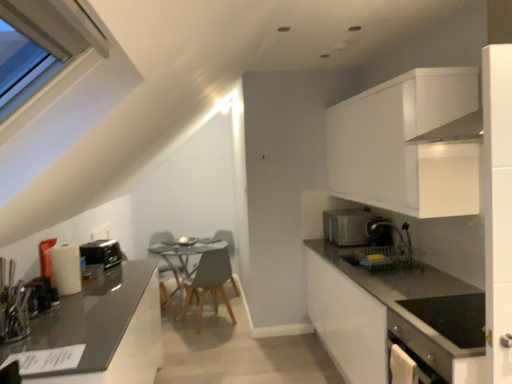
Question: In terms of size, does matte gray chair at center appear bigger or smaller than shiny dark gray countertop at left, which appears as the second countertop when viewed from the right?

Choices:
 (A) big
 (B) small

Answer: (B)

Question: Looking at their shapes, would you say matte gray chair at center is wider or thinner than shiny dark gray countertop at left, which ranks as the first countertop in left-to-right order?

Choices:
 (A) wide
 (B) thin

Answer: (B)

Question: Estimate the real-world distances between objects in this image. Which object is closer to the wooden chair at center?

Choices:
 (A) matte gray chair at center
 (B) white matte cabinet at upper right
 (C) metallic silver toaster at left, acting as the 1th appliance starting from the front
 (D) satin black coffee machine at right
 (E) matte gray countertop at right, which is the 2th countertop from left to right

Answer: (A)

Question: Estimate the real-world distances between objects in this image. Which object is closer to the transparent glass table at center?

Choices:
 (A) black plastic toaster at left, which is counted as the first appliance, starting from the back
 (B) matte gray chair at center
 (C) satin black coffee machine at right
 (D) white matte cabinet at upper right
 (E) shiny dark gray countertop at left, which ranks as the first countertop in left-to-right order

Answer: (B)